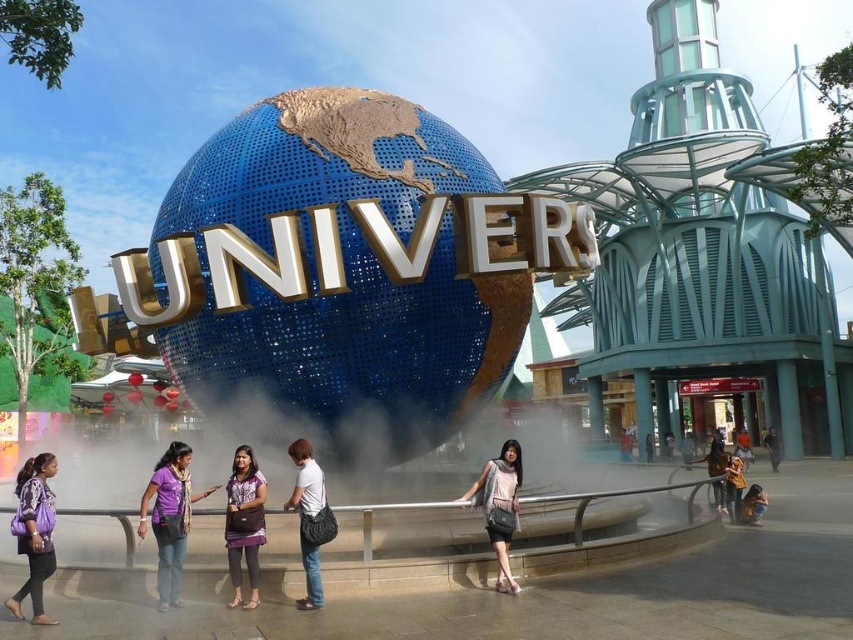
Looking at this image, can you confirm if purple fabric bag at lower left is positioned to the right of green fabric shirt at center?

Incorrect, purple fabric bag at lower left is not on the right side of green fabric shirt at center.

Does purple fabric bag at lower left appear on the left side of green fabric shirt at center?

Yes, purple fabric bag at lower left is to the left of green fabric shirt at center.

Image resolution: width=853 pixels, height=640 pixels. In order to click on purple fabric bag at lower left in this screenshot , I will do `click(33, 532)`.

Who is lower down, matte black jacket at lower right or green fabric shirt at center?

green fabric shirt at center

Can you confirm if matte black jacket at lower right is thinner than green fabric shirt at center?

No.

Is point (717, 492) closer to camera compared to point (764, 448)?

Yes, point (717, 492) is closer to viewer.

Locate an element on the screen. The width and height of the screenshot is (853, 640). matte black jacket at lower right is located at coordinates coord(717,468).

Can you confirm if white matte bag at center is bigger than brown leather jacket at lower right?

Yes, white matte bag at center is bigger than brown leather jacket at lower right.

Between white matte bag at center and brown leather jacket at lower right, which one is positioned higher?

Positioned higher is white matte bag at center.

Identify the location of white matte bag at center. The image size is (853, 640). (306, 516).

Locate an element on the screen. The width and height of the screenshot is (853, 640). white matte bag at center is located at coordinates (306, 516).